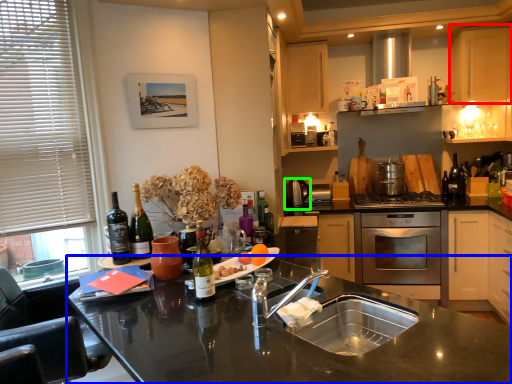
Question: Estimate the real-world distances between objects in this image. Which object is closer to cabinetry (highlighted by a red box), countertop (highlighted by a blue box) or appliance (highlighted by a green box)?

Choices:
 (A) countertop
 (B) appliance

Answer: (B)